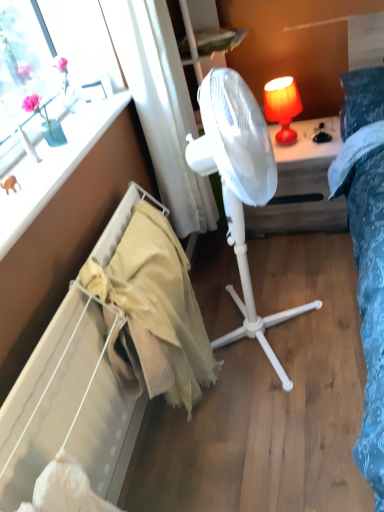
Question: From a real-world perspective, is beige fabric radiator at lower left physically below white sheer curtain at upper center?

Choices:
 (A) no
 (B) yes

Answer: (B)

Question: Considering the relative sizes of beige fabric radiator at lower left and white sheer curtain at upper center in the image provided, is beige fabric radiator at lower left wider than white sheer curtain at upper center?

Choices:
 (A) yes
 (B) no

Answer: (B)

Question: Can you confirm if beige fabric radiator at lower left is taller than white sheer curtain at upper center?

Choices:
 (A) yes
 (B) no

Answer: (B)

Question: Is beige fabric radiator at lower left oriented towards white sheer curtain at upper center?

Choices:
 (A) yes
 (B) no

Answer: (B)

Question: Is beige fabric radiator at lower left further to camera compared to white sheer curtain at upper center?

Choices:
 (A) yes
 (B) no

Answer: (B)

Question: Is the depth of beige fabric radiator at lower left less than that of white sheer curtain at upper center?

Choices:
 (A) no
 (B) yes

Answer: (B)

Question: Does white plastic fan at center appear on the left side of matte orange lampshade at upper right?

Choices:
 (A) no
 (B) yes

Answer: (A)

Question: Could matte orange lampshade at upper right be considered to be inside white plastic fan at center?

Choices:
 (A) yes
 (B) no

Answer: (B)

Question: Is white plastic fan at center thinner than matte orange lampshade at upper right?

Choices:
 (A) yes
 (B) no

Answer: (B)

Question: Does white plastic fan at center come behind matte orange lampshade at upper right?

Choices:
 (A) no
 (B) yes

Answer: (B)

Question: Is white plastic fan at center not within matte orange lampshade at upper right?

Choices:
 (A) yes
 (B) no

Answer: (A)

Question: Is white plastic fan at center positioned with its back to matte orange lampshade at upper right?

Choices:
 (A) yes
 (B) no

Answer: (B)

Question: Considering the relative sizes of white sheer curtain at upper center and white plastic fan at center in the image provided, is white sheer curtain at upper center smaller than white plastic fan at center?

Choices:
 (A) no
 (B) yes

Answer: (B)